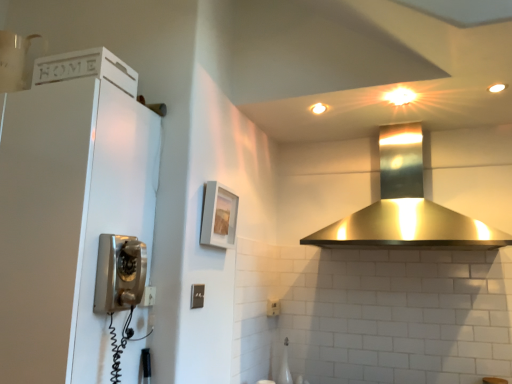
From the picture: Measure the distance between white matte cabinet at left and camera.

The depth of white matte cabinet at left is 3.99 feet.

This screenshot has height=384, width=512. Find the location of `satin silver light switch at center`. satin silver light switch at center is located at coordinates (197, 296).

The height and width of the screenshot is (384, 512). What do you see at coordinates (219, 216) in the screenshot?
I see `matte gray picture frame at center` at bounding box center [219, 216].

I want to click on white matte cabinet at left, so click(x=68, y=210).

From a real-world perspective, is polished stainless steel range hood at upper center positioned above or below white matte cabinet at left?

Clearly, from a real-world perspective, polished stainless steel range hood at upper center is above white matte cabinet at left.

Would you say polished stainless steel range hood at upper center is a long distance from white matte cabinet at left?

Yes, polished stainless steel range hood at upper center and white matte cabinet at left are quite far apart.

Does polished stainless steel range hood at upper center have a larger size compared to white matte cabinet at left?

Yes, polished stainless steel range hood at upper center is bigger than white matte cabinet at left.

Can you tell me how much polished stainless steel range hood at upper center and white matte cabinet at left differ in facing direction?

polished stainless steel range hood at upper center and white matte cabinet at left are facing 1.12 degrees away from each other.

From a real-world perspective, which is physically above, white matte cabinet at left or polished stainless steel range hood at upper center?

polished stainless steel range hood at upper center.

Which of these two, white matte cabinet at left or polished stainless steel range hood at upper center, is wider?

polished stainless steel range hood at upper center is wider.

Which is in front, point (69, 289) or point (390, 147)?

Point (69, 289)

From the picture: From a real-world perspective, is matte gray picture frame at center physically above polished stainless steel range hood at upper center?

Incorrect, from a real-world perspective, matte gray picture frame at center is lower than polished stainless steel range hood at upper center.

Relative to polished stainless steel range hood at upper center, is matte gray picture frame at center in front or behind?

matte gray picture frame at center is behind polished stainless steel range hood at upper center.

Who is bigger, matte gray picture frame at center or polished stainless steel range hood at upper center?

With larger size is polished stainless steel range hood at upper center.

Considering the points (97, 179) and (190, 308), which point is in front, point (97, 179) or point (190, 308)?

Point (97, 179)

Between white matte cabinet at left and satin silver light switch at center, which one appears on the right side from the viewer's perspective?

Positioned to the right is satin silver light switch at center.

The height and width of the screenshot is (384, 512). I want to click on light switch that is on the right side of white matte cabinet at left, so click(197, 296).

Between white matte cabinet at left and satin silver light switch at center, which one has larger size?

With larger size is white matte cabinet at left.

Would you say white matte cabinet at left is a long distance from matte gray picture frame at center?

No.

Looking at this image, considering the relative sizes of white matte cabinet at left and matte gray picture frame at center in the image provided, is white matte cabinet at left bigger than matte gray picture frame at center?

Indeed, white matte cabinet at left has a larger size compared to matte gray picture frame at center.

Which object is thinner, white matte cabinet at left or matte gray picture frame at center?

Thinner between the two is matte gray picture frame at center.

Is point (428, 230) farther from camera compared to point (203, 304)?

Yes, it is.

Considering the positions of objects polished stainless steel range hood at upper center and satin silver light switch at center in the image provided, who is in front, polished stainless steel range hood at upper center or satin silver light switch at center?

polished stainless steel range hood at upper center is more forward.

How different are the orientations of polished stainless steel range hood at upper center and satin silver light switch at center in degrees?

The facing directions of polished stainless steel range hood at upper center and satin silver light switch at center are 89.2 degrees apart.

Can you tell me how much satin silver light switch at center and matte gray picture frame at center differ in facing direction?

1.04 degrees separate the facing orientations of satin silver light switch at center and matte gray picture frame at center.

Which object is thinner, satin silver light switch at center or matte gray picture frame at center?

satin silver light switch at center is thinner.

Considering the positions of objects satin silver light switch at center and matte gray picture frame at center in the image provided, who is in front, satin silver light switch at center or matte gray picture frame at center?

Positioned in front is satin silver light switch at center.

Is matte gray picture frame at center inside satin silver light switch at center?

No, satin silver light switch at center does not contain matte gray picture frame at center.

You are a GUI agent. You are given a task and a screenshot of the screen. Output one action in this format:
    pyautogui.click(x=<x>, y=<y>)
    Task: Click on the home appliance behind the white matte cabinet at left
    This screenshot has height=384, width=512.
    Given the screenshot: What is the action you would take?
    pyautogui.click(x=406, y=207)

The height and width of the screenshot is (384, 512). In order to click on appliance below the polished stainless steel range hood at upper center (from a real-world perspective) in this screenshot , I will do `click(68, 210)`.

Based on their spatial positions, is polished stainless steel range hood at upper center or satin silver light switch at center closer to white matte cabinet at left?

satin silver light switch at center lies closer to white matte cabinet at left than the other object.

Estimate the real-world distances between objects in this image. Which object is closer to matte gray picture frame at center, white matte cabinet at left or satin silver light switch at center?

Among the two, satin silver light switch at center is located nearer to matte gray picture frame at center.

Based on their spatial positions, is white matte cabinet at left or polished stainless steel range hood at upper center closer to satin silver light switch at center?

Based on the image, white matte cabinet at left appears to be nearer to satin silver light switch at center.

When comparing their distances from satin silver light switch at center, does polished stainless steel range hood at upper center or white matte cabinet at left seem further?

polished stainless steel range hood at upper center is positioned further to the anchor satin silver light switch at center.

Which object lies further to the anchor point polished stainless steel range hood at upper center, white matte cabinet at left or matte gray picture frame at center?

white matte cabinet at left lies further to polished stainless steel range hood at upper center than the other object.

Estimate the real-world distances between objects in this image. Which object is closer to white matte cabinet at left, polished stainless steel range hood at upper center or matte gray picture frame at center?

matte gray picture frame at center is closer to white matte cabinet at left.

Based on their spatial positions, is matte gray picture frame at center or satin silver light switch at center further from white matte cabinet at left?

satin silver light switch at center.

Based on their spatial positions, is polished stainless steel range hood at upper center or matte gray picture frame at center closer to satin silver light switch at center?

matte gray picture frame at center is closer to satin silver light switch at center.

You are a GUI agent. You are given a task and a screenshot of the screen. Output one action in this format:
    pyautogui.click(x=<x>, y=<y>)
    Task: Click on the picture frame situated between white matte cabinet at left and polished stainless steel range hood at upper center from left to right
    
    Given the screenshot: What is the action you would take?
    pyautogui.click(x=219, y=216)

Locate an element on the screen. The image size is (512, 384). picture frame located between satin silver light switch at center and polished stainless steel range hood at upper center in the left-right direction is located at coordinates point(219,216).

The height and width of the screenshot is (384, 512). I want to click on light switch between white matte cabinet at left and polished stainless steel range hood at upper center from left to right, so click(197, 296).

Locate an element on the screen. light switch between white matte cabinet at left and matte gray picture frame at center from left to right is located at coordinates (197, 296).